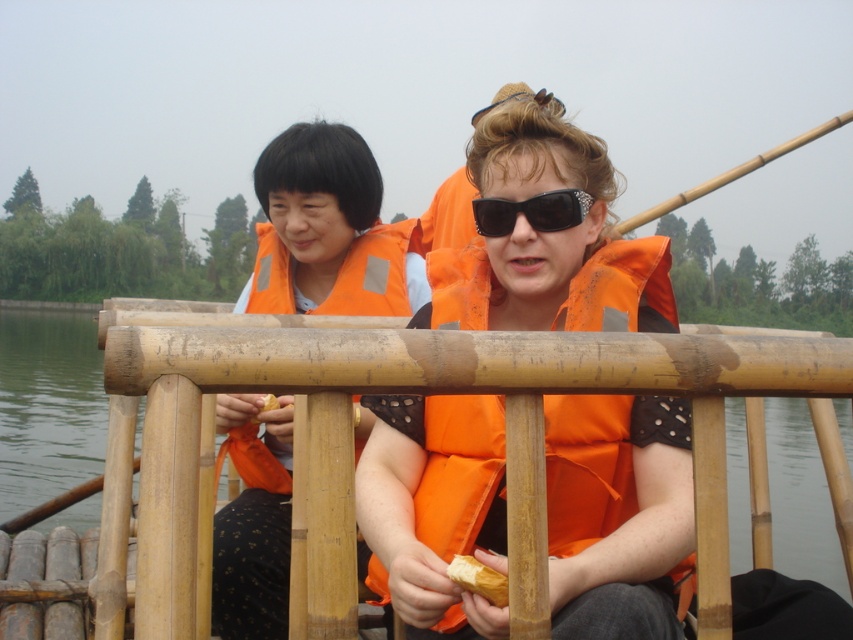
You are a photographer trying to capture a clear photo of both the orange life vest at center and the black textured sunglasses at center. Since you can only focus on one object at a time, which one should you focus on to ensure it appears sharp and in focus while the other becomes slightly blurry?

→ You should focus on the orange life vest at center because it is closer to the viewer than the black textured sunglasses at center. When focusing on the closer object, it will appear sharp, and the farther one will naturally blur.